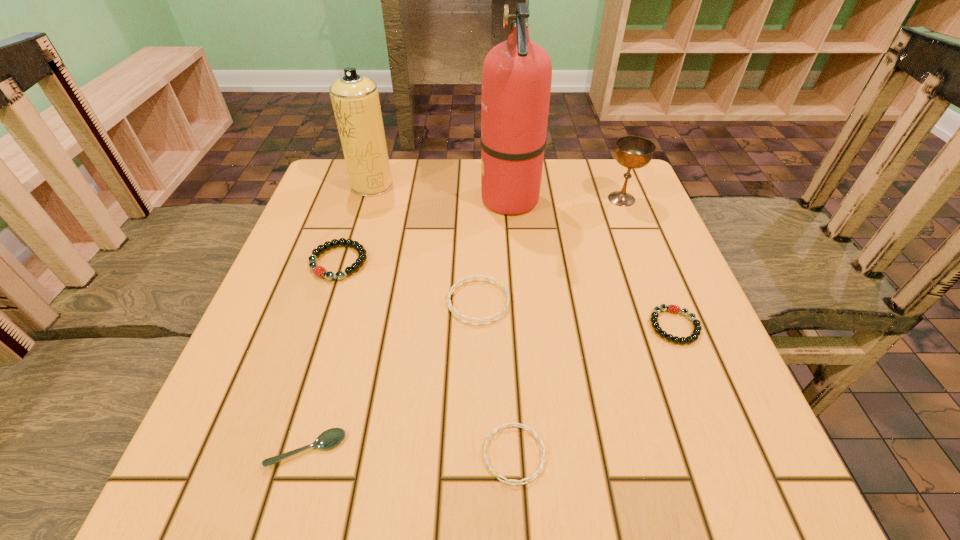
Locate an element on the screen. free space at the right edge of the desktop is located at coordinates (713, 402).

Where is `vacant area at the far left corner`? vacant area at the far left corner is located at coordinates (361, 198).

This screenshot has width=960, height=540. I want to click on vacant space at the far right corner of the desktop, so click(x=594, y=202).

Where is `vacant space in between the seventh shortest object and the shortest bracelet`? vacant space in between the seventh shortest object and the shortest bracelet is located at coordinates (444, 320).

I want to click on free space between the chalice and the farther blue bracelet, so click(x=550, y=251).

In order to click on vacant space that's between the aerosol can and the red fire extinguisher in this screenshot , I will do point(442,192).

The height and width of the screenshot is (540, 960). Identify the location of vacant area between the third tallest object and the rightmost bracelet. (648, 262).

This screenshot has width=960, height=540. I want to click on empty space that is in between the shortest bracelet and the leftmost bracelet, so click(426, 358).

Locate an element on the screen. This screenshot has width=960, height=540. free space between the tallest object and the farther blue bracelet is located at coordinates (494, 251).

The height and width of the screenshot is (540, 960). What are the coordinates of `vacant region between the soupspoon and the red fire extinguisher` in the screenshot? It's located at (409, 324).